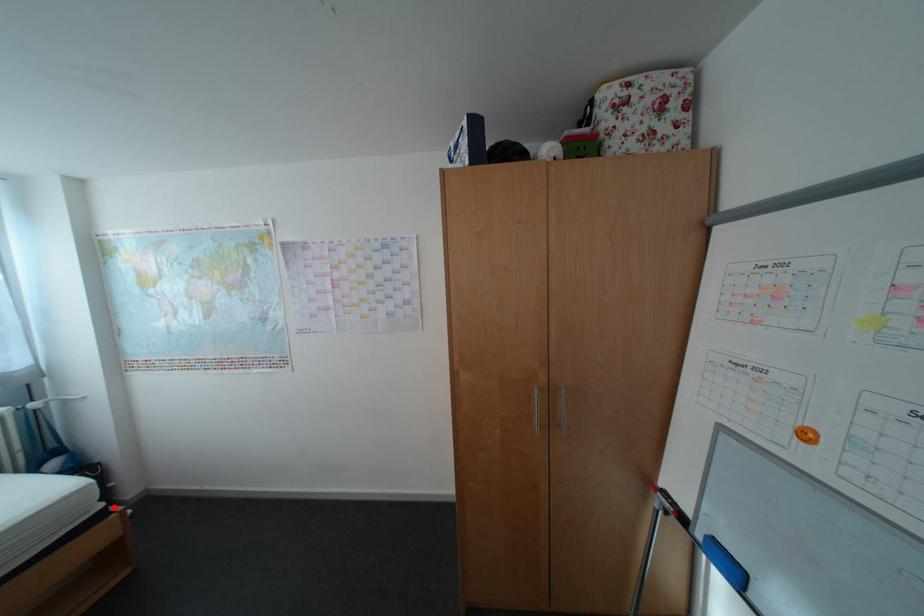
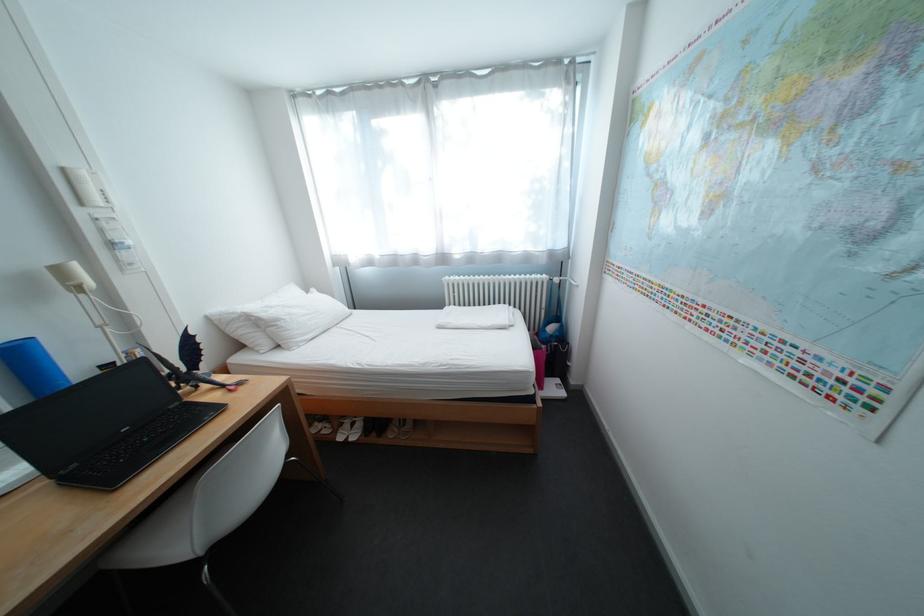
Question: I am providing you with two images of the same scene from different viewpoints. A red point is shown in image1. For the corresponding object point in image2, is it positioned nearer or farther from the camera?

Choices:
 (A) Nearer
 (B) Farther

Answer: (B)